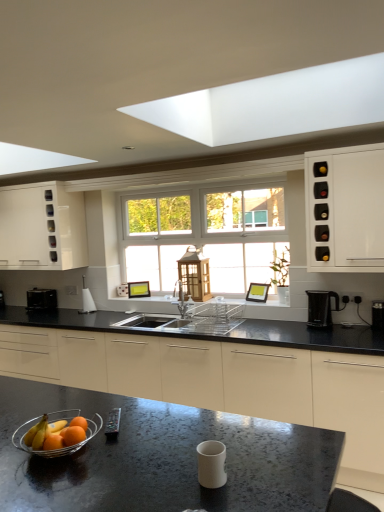
At what (x,y) coordinates should I click in order to perform the action: click on free space between white matte cup at center, the first appliance when ordered from front to back, and clear glass bowl at lower left. Please return your answer as a coordinate pair (x, y). This screenshot has width=384, height=512. Looking at the image, I should click on (142, 463).